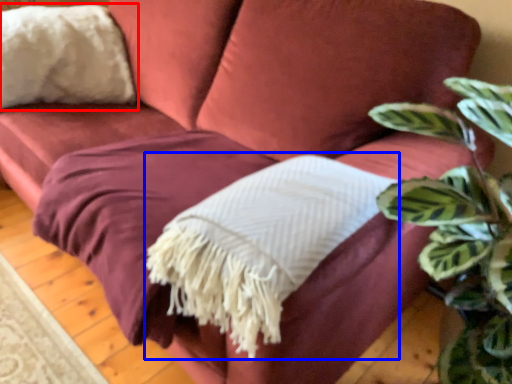
Question: Which object is closer to the camera taking this photo, throw pillow (highlighted by a red box) or blanket (highlighted by a blue box)?

Choices:
 (A) throw pillow
 (B) blanket

Answer: (B)